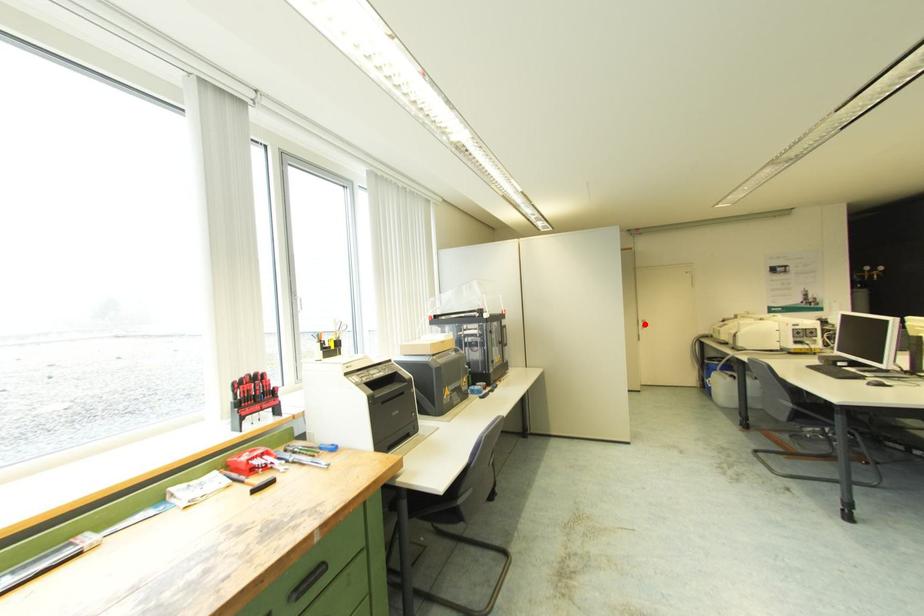
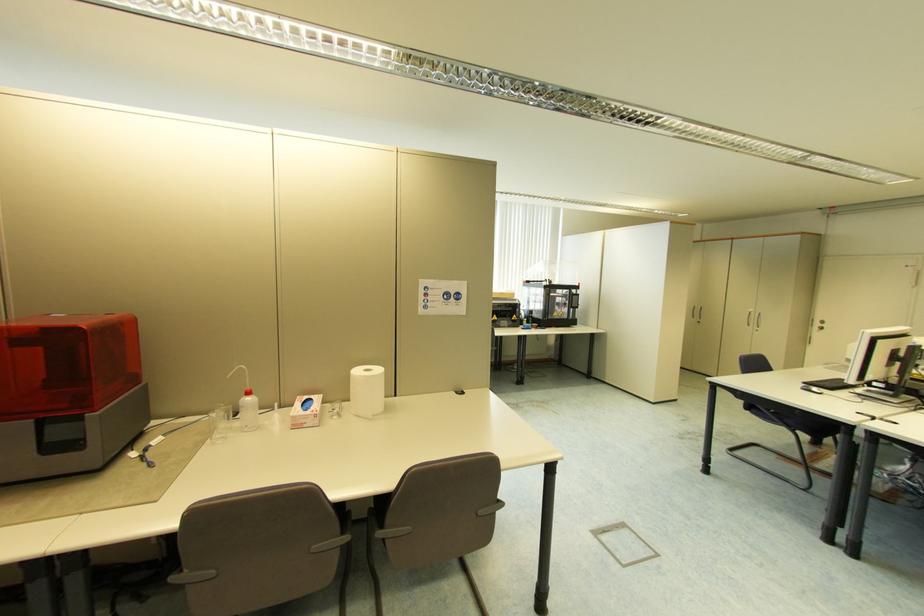
The point at the highlighted location is marked in the first image. Where is the corresponding point in the second image?

(821, 325)